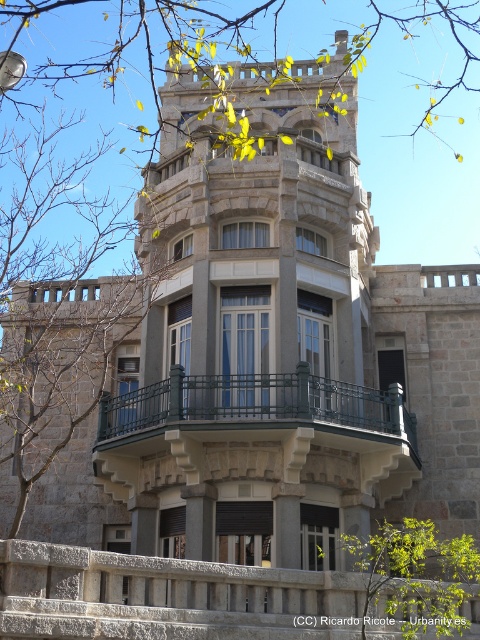
Consider the image. You are standing in front of the building and want to take a photo that includes both the gray stone balustrade at lower center and the green leafy tree at center. Based on their positions, which object should you position to the left side of your camera frame to include both?

The gray stone balustrade at lower center is to the left of the green leafy tree at center, so you should position the gray stone balustrade at lower center on the left side of your camera frame to include both in the photo.

You are a window washer standing on the roof of the building. You need to clean the green leafy tree at center and the green wrought iron balcony at center. Which object is wider so you can decide which requires a larger ladder?

The green wrought iron balcony at center might be wider than green leafy tree at center according to the description, so you should use a larger ladder for the balcony.